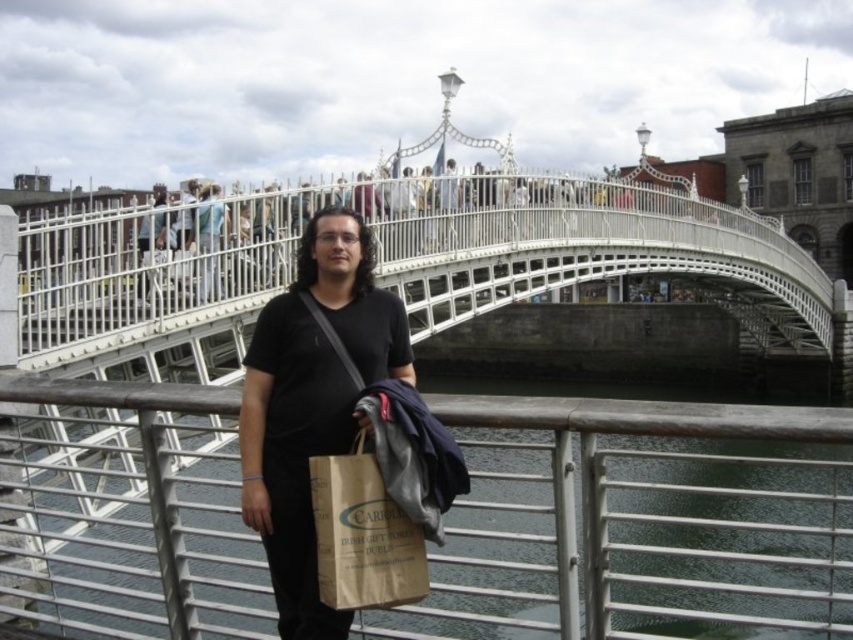
Who is lower down, white metal bridge at center or black matte shirt at center?

black matte shirt at center is lower down.

Does white metal bridge at center have a lesser height compared to black matte shirt at center?

Incorrect, white metal bridge at center's height does not fall short of black matte shirt at center's.

Is point (659, 253) closer to viewer compared to point (256, 358)?

No.

The height and width of the screenshot is (640, 853). I want to click on white metal bridge at center, so click(404, 260).

Consider the image. Can you confirm if greenish water at bridge center is positioned to the left of black matte shirt at center?

No, greenish water at bridge center is not to the left of black matte shirt at center.

Who is more forward, (173,458) or (267,385)?

Positioned in front is point (267,385).

Locate an element on the screen. The image size is (853, 640). greenish water at bridge center is located at coordinates (637, 524).

Is black matte shirt at center positioned in front of matte black shirt at center?

Yes, black matte shirt at center is in front of matte black shirt at center.

Does black matte shirt at center have a larger size compared to matte black shirt at center?

Yes.

Is point (325, 387) positioned in front of point (202, 301)?

Yes.

Locate an element on the screen. The image size is (853, 640). black matte shirt at center is located at coordinates pyautogui.click(x=312, y=403).